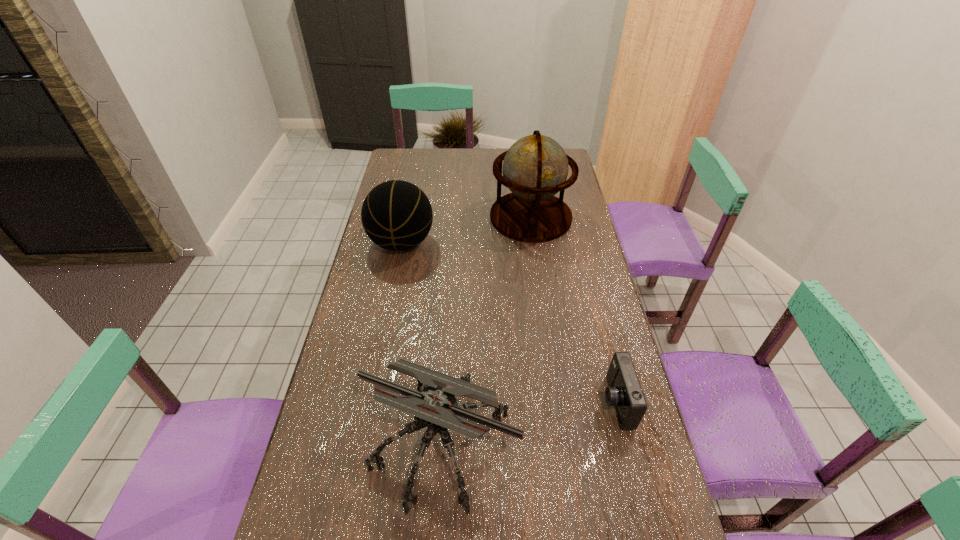
Identify the location of the tallest object. The height and width of the screenshot is (540, 960). (535, 168).

You are a GUI agent. You are given a task and a screenshot of the screen. Output one action in this format:
    pyautogui.click(x=<x>, y=<y>)
    Task: Click on the basketball
    
    Given the screenshot: What is the action you would take?
    pyautogui.click(x=396, y=215)

Identify the location of drone. The height and width of the screenshot is (540, 960). (436, 407).

Image resolution: width=960 pixels, height=540 pixels. In order to click on camera in this screenshot , I will do `click(624, 392)`.

Where is `vacant space situated 0.140m on the front-facing side of the globe`? The height and width of the screenshot is (540, 960). vacant space situated 0.140m on the front-facing side of the globe is located at coordinates (538, 269).

Find the location of a particular element. The width and height of the screenshot is (960, 540). vacant area situated on the right of the basketball is located at coordinates (535, 243).

At what (x,y) coordinates should I click in order to perform the action: click on vacant space located on the right of the drone. Please return your answer as a coordinate pair (x, y). Looking at the image, I should click on (567, 441).

At what (x,y) coordinates should I click in order to perform the action: click on vacant region located on the front-facing side of the shortest object. Please return your answer as a coordinate pair (x, y). This screenshot has height=540, width=960. Looking at the image, I should click on (503, 402).

This screenshot has height=540, width=960. I want to click on free space located 0.340m on the front-facing side of the shortest object, so click(473, 402).

You are a GUI agent. You are given a task and a screenshot of the screen. Output one action in this format:
    pyautogui.click(x=<x>, y=<y>)
    Task: Click on the free space located on the front-facing side of the shortest object
    
    Given the screenshot: What is the action you would take?
    pyautogui.click(x=538, y=402)